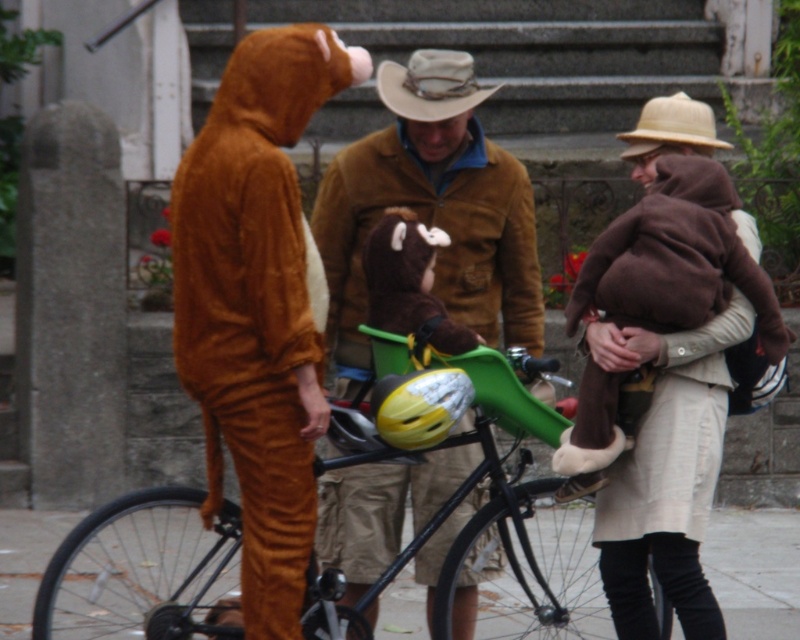
Question: Which point appears farthest from the camera in this image?

Choices:
 (A) (400, 230)
 (B) (438, 276)
 (C) (649, 627)
 (D) (670, 112)

Answer: (D)

Question: Is green matte bicycle at center bigger than brown suede jacket at center?

Choices:
 (A) no
 (B) yes

Answer: (B)

Question: Does velvet brown bear suit at left have a larger size compared to green matte bicycle at center?

Choices:
 (A) yes
 (B) no

Answer: (B)

Question: Can you confirm if brown suede jacket at center is thinner than brown plush bear at center?

Choices:
 (A) no
 (B) yes

Answer: (A)

Question: Which object is farther from the camera taking this photo?

Choices:
 (A) brown felt cowboy hat at upper center
 (B) velvet brown bear suit at left

Answer: (A)

Question: Which point is closer to the camera?

Choices:
 (A) brown felt cowboy hat at upper center
 (B) brown plush bear at center
 (C) brown suede jacket at center
 (D) green matte bicycle at center

Answer: (D)